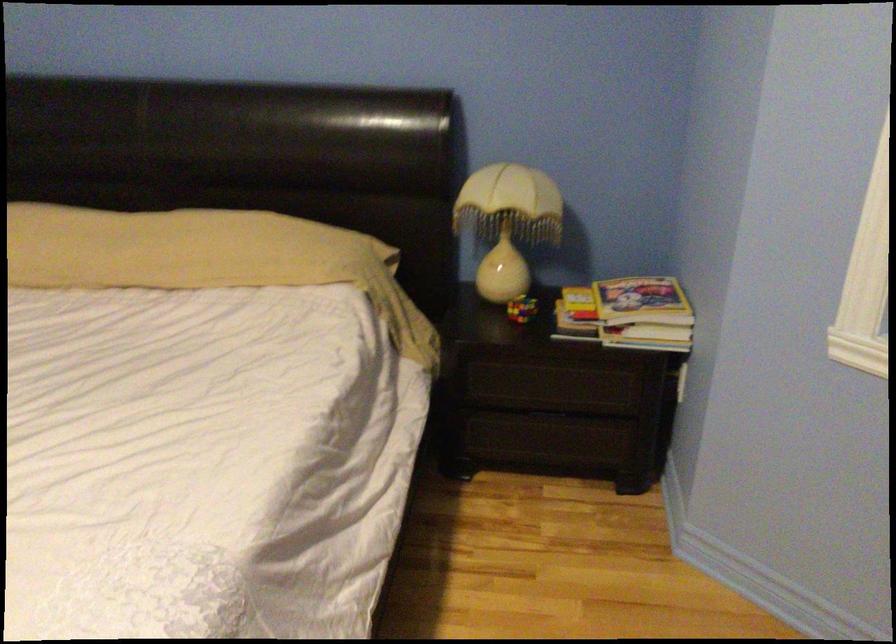
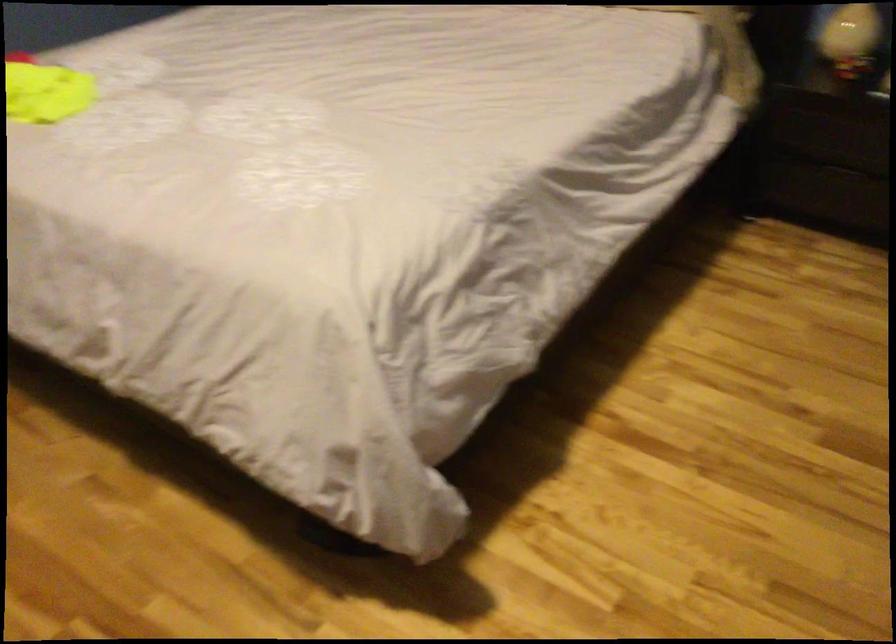
First-person continuous shooting, in which direction is the camera rotating?

The rotation direction of the camera is left-down.